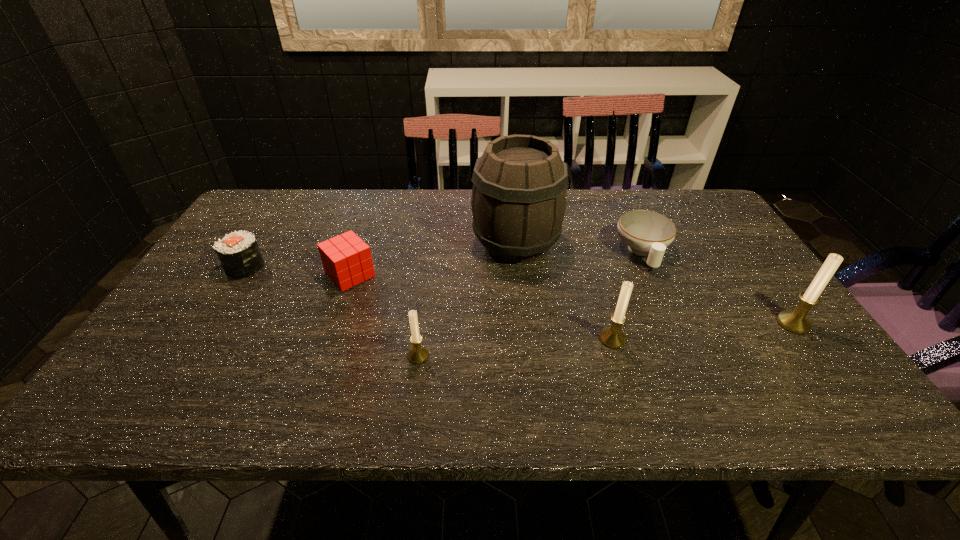
Please show where to add a candle holder on the left while keeping spacing even. Please provide its 2D coordinates. Your answer should be formatted as a tuple, i.e. [(x, y)], where the tuple contains the x and y coordinates of a point satisfying the conditions above.

[(209, 374)]